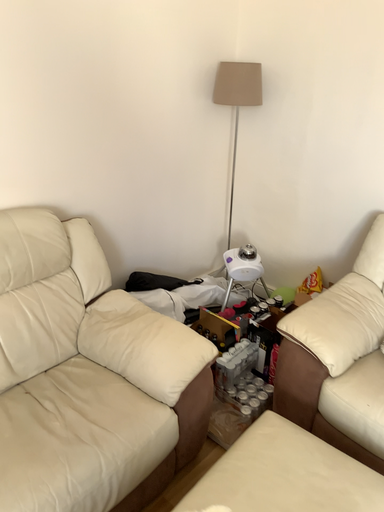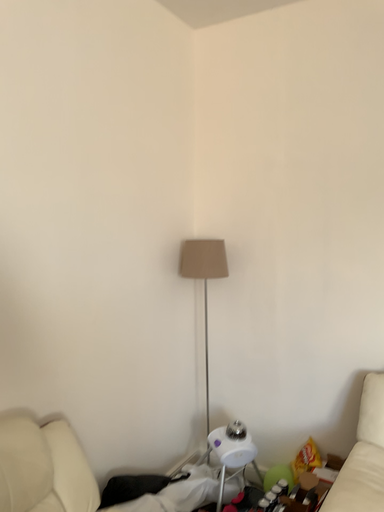
Question: Which way did the camera rotate in the video?

Choices:
 (A) rotated left
 (B) rotated right

Answer: (B)